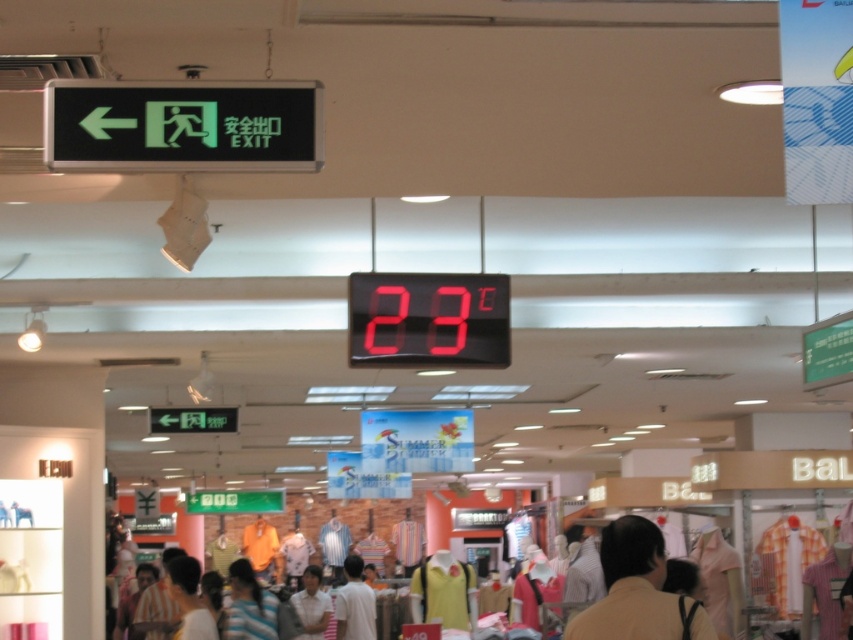
Question: Is light brown shirt at center positioned before white shirt at center?

Choices:
 (A) yes
 (B) no

Answer: (B)

Question: Which point is farther to the camera?

Choices:
 (A) brown fabric shirt at lower right
 (B) light brown shirt at center
 (C) white shirt at center

Answer: (B)

Question: Is brown fabric shirt at lower right bigger than white shirt at center?

Choices:
 (A) yes
 (B) no

Answer: (A)

Question: Which of the following is the closest to the observer?

Choices:
 (A) (352, 632)
 (B) (631, 618)
 (C) (312, 634)

Answer: (B)

Question: From the image, what is the correct spatial relationship of brown fabric shirt at lower right in relation to light brown shirt at center?

Choices:
 (A) above
 (B) below

Answer: (A)

Question: Which of these objects is positioned closest to the white shirt at center?

Choices:
 (A) brown fabric shirt at lower right
 (B) light brown shirt at center

Answer: (B)